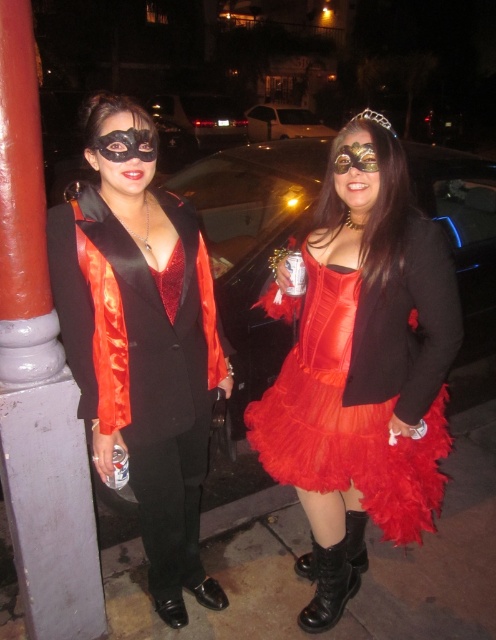
Question: Among these points, which one is nearest to the camera?

Choices:
 (A) (345, 403)
 (B) (140, 321)

Answer: (B)

Question: Among these points, which one is farthest from the camera?

Choices:
 (A) (154, 554)
 (B) (419, 516)

Answer: (A)

Question: Which point is farther to the camera?

Choices:
 (A) shiny satin dress at center
 (B) satin black vest at left

Answer: (A)

Question: Is satin black vest at left to the left of shiny satin dress at center from the viewer's perspective?

Choices:
 (A) yes
 (B) no

Answer: (A)

Question: Is satin black vest at left to the left of shiny satin dress at center from the viewer's perspective?

Choices:
 (A) yes
 (B) no

Answer: (A)

Question: Does satin black vest at left have a greater width compared to shiny satin dress at center?

Choices:
 (A) no
 (B) yes

Answer: (A)